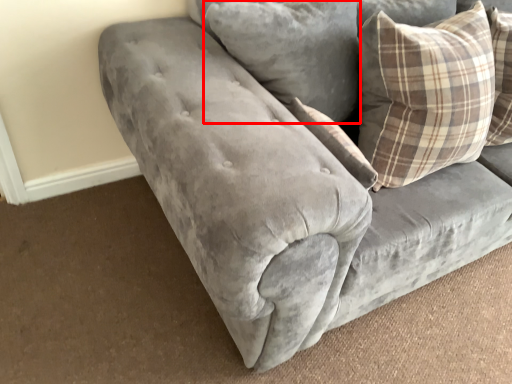
Question: From the image's perspective, considering the relative positions of pillow (annotated by the red box) and pillow in the image provided, where is pillow (annotated by the red box) located with respect to the staircase?

Choices:
 (A) above
 (B) below

Answer: (A)